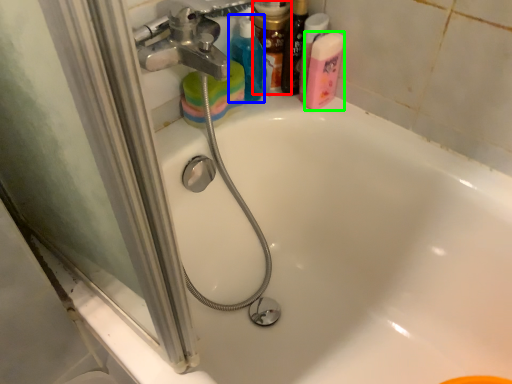
Question: Which object is positioned closest to toiletry (highlighted by a red box)? Select from cleaning product (highlighted by a blue box) and cleaning product (highlighted by a green box).

Choices:
 (A) cleaning product
 (B) cleaning product

Answer: (A)